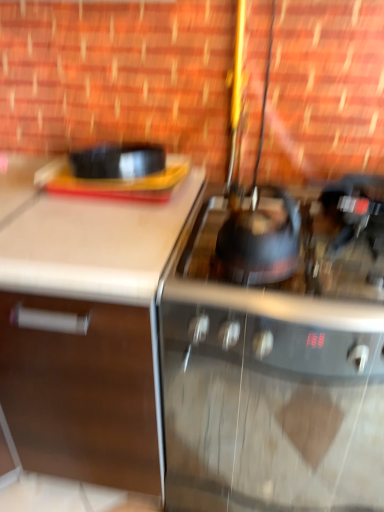
Question: In which direction should I rotate to look at shiny black kettle at center, the 1th gas stove in the top-to-bottom sequence?

Choices:
 (A) left
 (B) right

Answer: (B)

Question: Is shiny black kettle at center smaller than white matte cabinet at left?

Choices:
 (A) no
 (B) yes

Answer: (B)

Question: Is the position of shiny black kettle at center less distant than that of white matte cabinet at left?

Choices:
 (A) yes
 (B) no

Answer: (B)

Question: Are shiny black kettle at center and white matte cabinet at left beside each other?

Choices:
 (A) yes
 (B) no

Answer: (B)

Question: Is shiny black kettle at center positioned beyond the bounds of white matte cabinet at left?

Choices:
 (A) no
 (B) yes

Answer: (B)

Question: Is white matte cabinet at left at the back of shiny black kettle at center?

Choices:
 (A) no
 (B) yes

Answer: (A)

Question: Considering the relative positions of shiny black kettle at center and white matte cabinet at left in the image provided, is shiny black kettle at center to the right of white matte cabinet at left from the viewer's perspective?

Choices:
 (A) no
 (B) yes

Answer: (B)

Question: From the image's perspective, would you say stainless steel gas stove at center, the 2th gas stove when ordered from top to bottom, is positioned over shiny black kettle at center, the second gas stove when ordered from bottom to top?

Choices:
 (A) yes
 (B) no

Answer: (B)

Question: Is stainless steel gas stove at center, which ranks as the 1th gas stove in bottom-to-top order, positioned far away from shiny black kettle at center, the second gas stove when ordered from bottom to top?

Choices:
 (A) yes
 (B) no

Answer: (B)

Question: From a real-world perspective, does stainless steel gas stove at center, the 2th gas stove when ordered from top to bottom, stand above shiny black kettle at center, the second gas stove when ordered from bottom to top?

Choices:
 (A) no
 (B) yes

Answer: (A)

Question: Can we say stainless steel gas stove at center, which ranks as the 1th gas stove in bottom-to-top order, lies outside shiny black kettle at center, the 1th gas stove in the top-to-bottom sequence?

Choices:
 (A) yes
 (B) no

Answer: (A)

Question: Can you confirm if stainless steel gas stove at center, the 2th gas stove when ordered from top to bottom, is positioned to the right of shiny black kettle at center, the second gas stove when ordered from bottom to top?

Choices:
 (A) yes
 (B) no

Answer: (A)

Question: From a real-world perspective, is stainless steel gas stove at center, which ranks as the 1th gas stove in bottom-to-top order, located beneath shiny black kettle at center, the second gas stove when ordered from bottom to top?

Choices:
 (A) yes
 (B) no

Answer: (A)

Question: Does shiny black kettle at center, the second gas stove when ordered from bottom to top, come in front of stainless steel gas stove at center, the 2th gas stove when ordered from top to bottom?

Choices:
 (A) no
 (B) yes

Answer: (B)